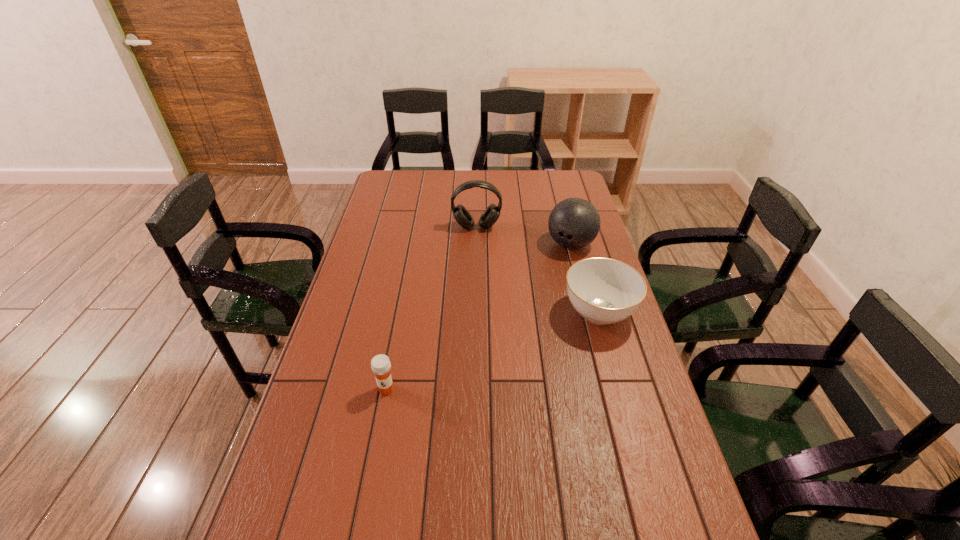
You are a GUI agent. You are given a task and a screenshot of the screen. Output one action in this format:
    pyautogui.click(x=<x>, y=<y>)
    Task: Click on the leftmost object
    The width and height of the screenshot is (960, 540).
    Given the screenshot: What is the action you would take?
    pyautogui.click(x=380, y=364)

Where is `medicine`? medicine is located at coordinates (380, 364).

Where is `the third farthest object`? The height and width of the screenshot is (540, 960). the third farthest object is located at coordinates (604, 291).

Where is `the second object from left to right`? Image resolution: width=960 pixels, height=540 pixels. the second object from left to right is located at coordinates (491, 214).

Locate an element on the screen. Image resolution: width=960 pixels, height=540 pixels. bowling ball is located at coordinates (574, 223).

I want to click on free location located on the label side of the leftmost object, so click(x=371, y=471).

Where is `vacant point located 0.190m on the left of the chinaware`? vacant point located 0.190m on the left of the chinaware is located at coordinates (502, 313).

Identify the location of vacant space located 0.370m on the earcups of the headset. The height and width of the screenshot is (540, 960). (480, 298).

Identify the location of vacant space located on the earcups of the headset. The width and height of the screenshot is (960, 540). (478, 242).

Find the location of a particular element. vacant region located on the earcups of the headset is located at coordinates (478, 248).